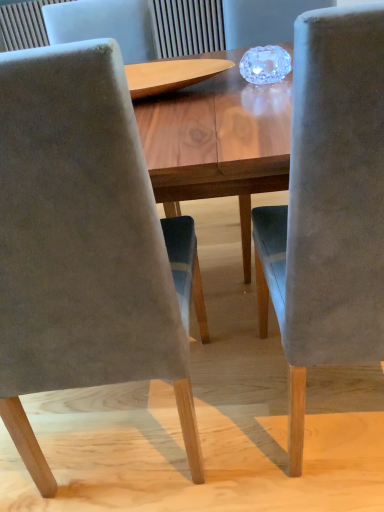
Question: From a real-world perspective, relative to velvet gray chair at center, which ranks as the second chair in right-to-left order, is velvet gray chair at right, which ranks as the first chair in right-to-left order, vertically above or below?

Choices:
 (A) below
 (B) above

Answer: (A)

Question: From their relative heights in the image, would you say velvet gray chair at right, which ranks as the first chair in right-to-left order, is taller or shorter than velvet gray chair at center, which ranks as the second chair in right-to-left order?

Choices:
 (A) tall
 (B) short

Answer: (B)

Question: In terms of width, does velvet gray chair at right, which ranks as the first chair in right-to-left order, look wider or thinner when compared to velvet gray chair at center, the 1th chair positioned from the left?

Choices:
 (A) thin
 (B) wide

Answer: (A)

Question: From the image's perspective, is velvet gray chair at center, which ranks as the second chair in right-to-left order, positioned above or below velvet gray chair at right, which ranks as the first chair in right-to-left order?

Choices:
 (A) below
 (B) above

Answer: (A)

Question: Is velvet gray chair at center, the 1th chair positioned from the left, spatially inside velvet gray chair at right, which ranks as the first chair in right-to-left order, or outside of it?

Choices:
 (A) outside
 (B) inside

Answer: (A)

Question: Is velvet gray chair at center, the 1th chair positioned from the left, to the left or to the right of velvet gray chair at right, which ranks as the first chair in right-to-left order, in the image?

Choices:
 (A) right
 (B) left

Answer: (B)

Question: In terms of size, does velvet gray chair at center, the 1th chair positioned from the left, appear bigger or smaller than velvet gray chair at right, which ranks as the first chair in right-to-left order?

Choices:
 (A) small
 (B) big

Answer: (B)